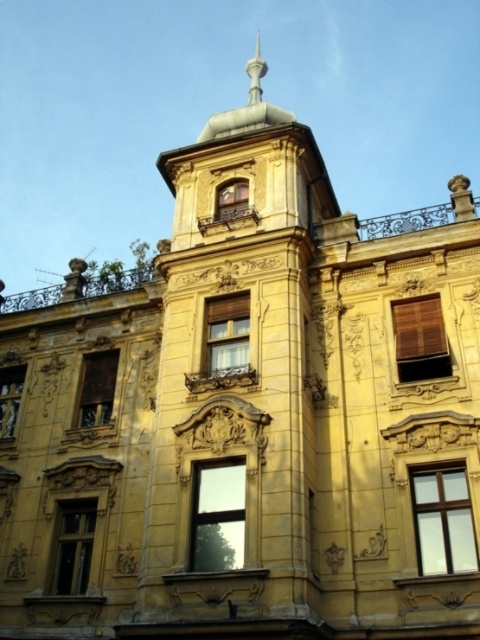
You are an architect inspecting the building facade. You notice the brown woven blinds at upper center and the matte glass window at lower left. Which of these two has a smaller width?

The brown woven blinds at upper center has a lesser width compared to the matte glass window at lower left, so the brown woven blinds at upper center is smaller in width.

You are standing in front of the grand building and want to take a photo. You notice two points on the building marked as point 1 at coordinates (415, 516) and point 2 at coordinates (214, 321). Which point is closer to your camera lens?

Point 1 at coordinates (415, 516) is closer to the camera lens than point 2 at coordinates (214, 321).